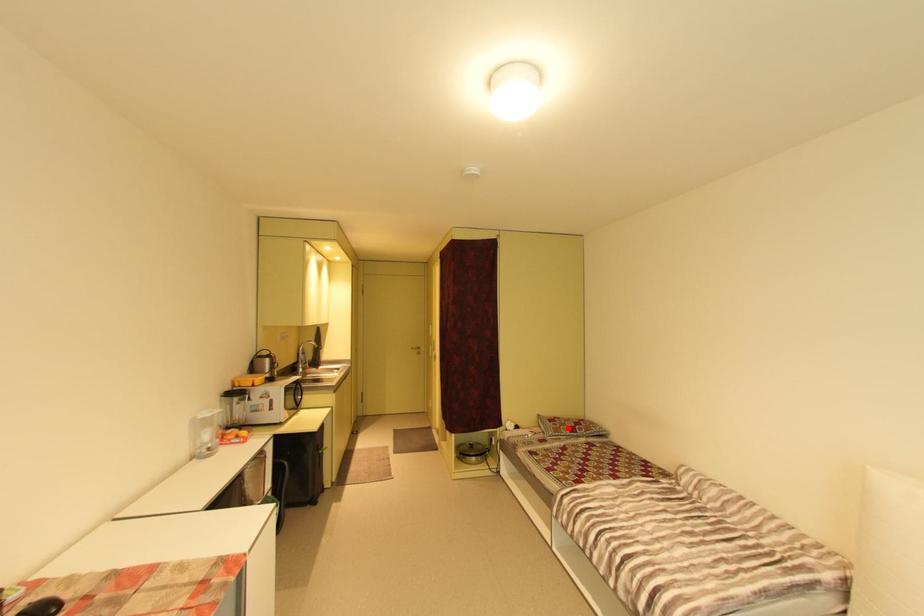
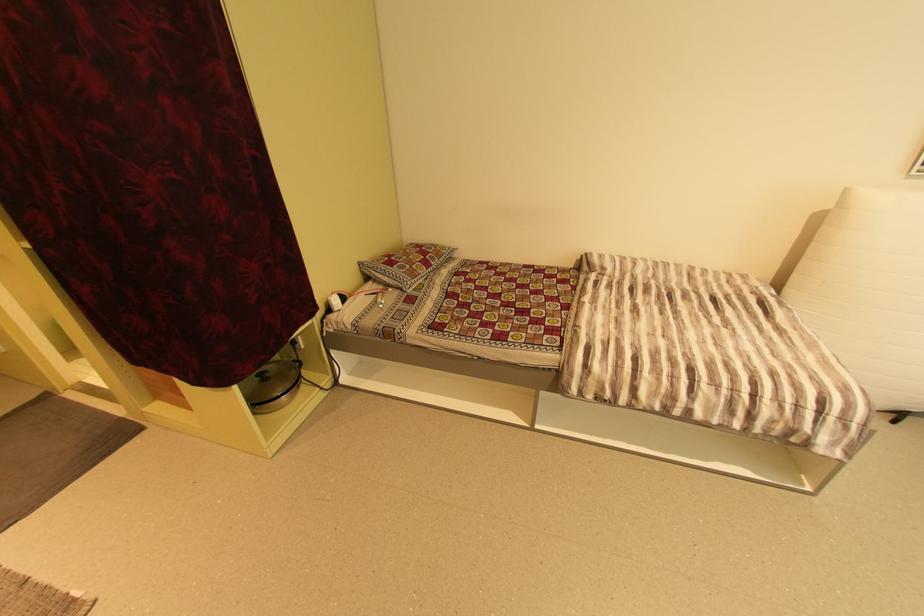
Question: A red point is marked in image1. In image2, is the corresponding 3D point closer to the camera or farther? Reply with the corresponding letter.

Choices:
 (A) The corresponding 3D point is closer.
 (B) The corresponding 3D point is farther.

Answer: (A)